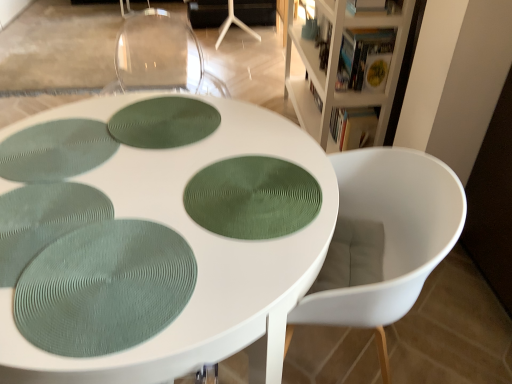
The image size is (512, 384). I want to click on vacant area that lies between green textured placemat at center, acting as the second oval starting from the back, and green textured placemat at lower left, the 3th oval positioned from the top, so click(183, 236).